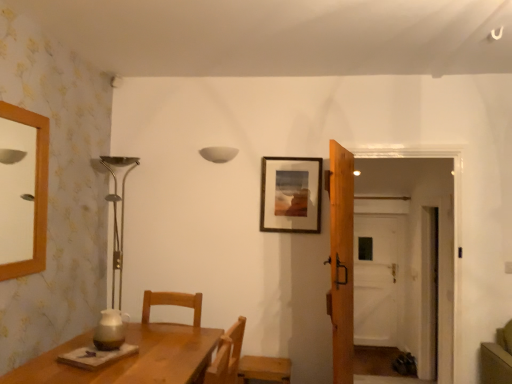
Question: Is transparent glass door at center bigger or smaller than wooden chair at lower right?

Choices:
 (A) big
 (B) small

Answer: (A)

Question: Considering the positions of point (380, 319) and point (271, 377), is point (380, 319) closer or farther from the camera than point (271, 377)?

Choices:
 (A) farther
 (B) closer

Answer: (A)

Question: Estimate the real-world distances between objects in this image. Which object is farther from the matte wooden picture frame at upper center?

Choices:
 (A) transparent glass door at center
 (B) wooden door at center
 (C) wooden chair at lower right
 (D) white matte lampshade at upper center

Answer: (A)

Question: Which of these objects is positioned farthest from the transparent glass door at center?

Choices:
 (A) wooden door at center
 (B) white matte lampshade at upper center
 (C) wooden chair at lower right
 (D) matte wooden picture frame at upper center

Answer: (B)